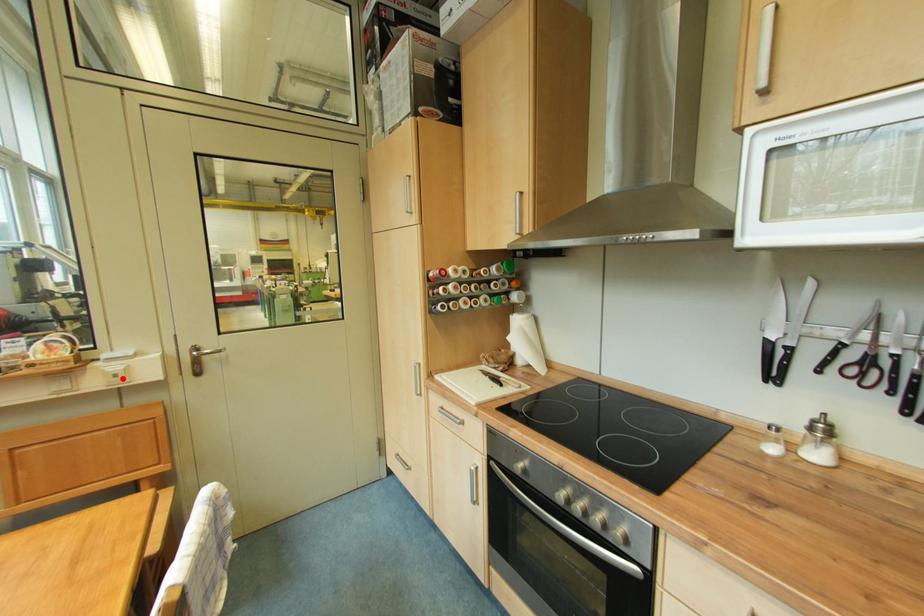
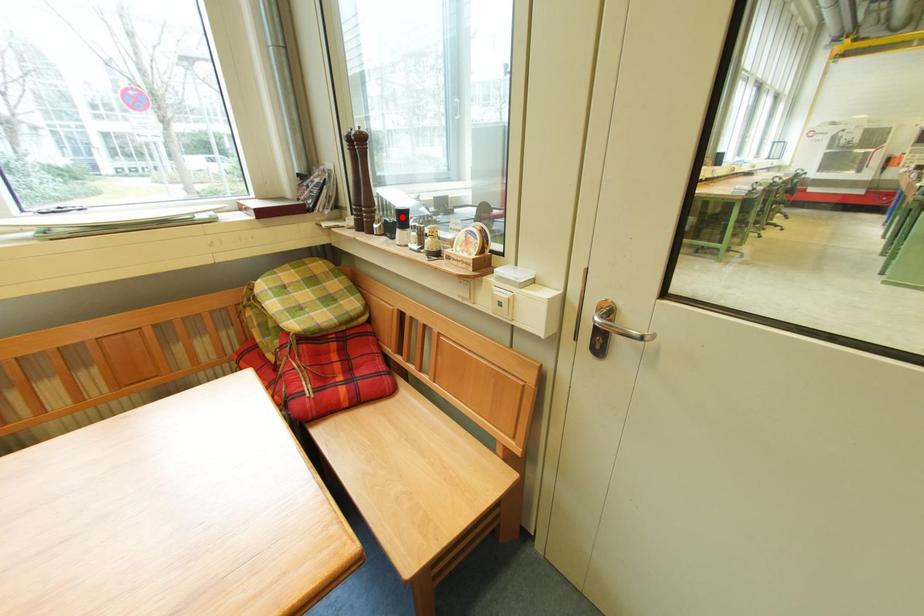
I am providing you with two images of the same scene from different viewpoints. A red point is marked on the first image and another point is marked on the second image. Are the points marked in image1 and image2 representing the same 3D position?

No